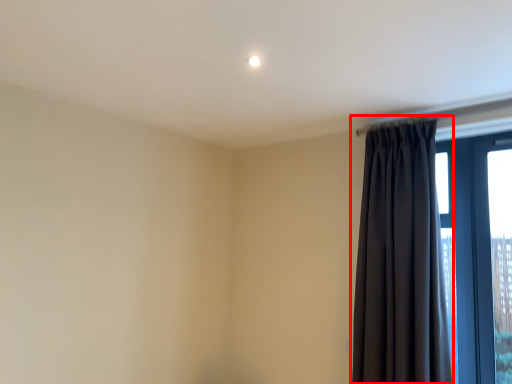
Question: From the image's perspective, considering the relative positions of curtain (annotated by the red box) and window in the image provided, where is curtain (annotated by the red box) located with respect to the staircase?

Choices:
 (A) above
 (B) below

Answer: (A)